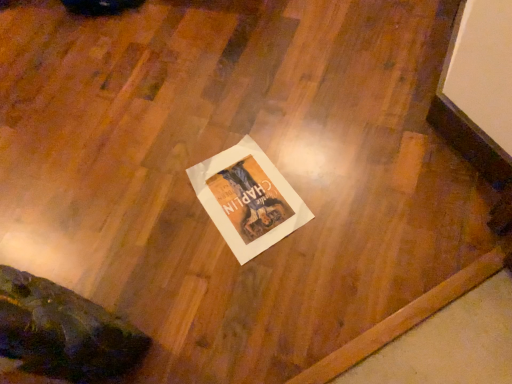
Question: Should I look upward or downward to see white paper poster at center?

Choices:
 (A) down
 (B) up

Answer: (A)